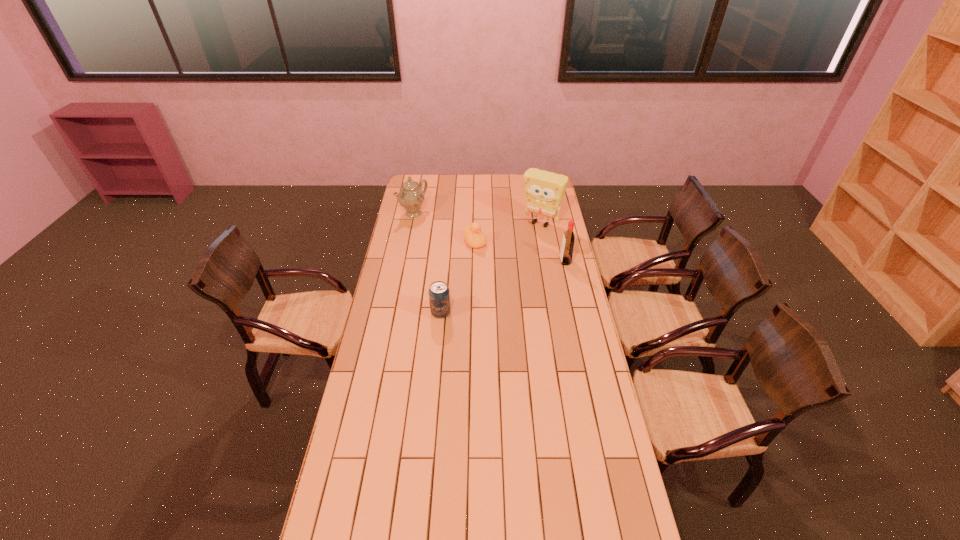
Where is `the second object from left to right`? This screenshot has width=960, height=540. the second object from left to right is located at coordinates (439, 294).

The height and width of the screenshot is (540, 960). I want to click on pop soda, so click(x=439, y=294).

Find the location of a particular element. The width and height of the screenshot is (960, 540). the second nearest object is located at coordinates (566, 253).

What are the coordinates of `the third farthest object` in the screenshot? It's located at (473, 237).

Where is `duck`? Image resolution: width=960 pixels, height=540 pixels. duck is located at coordinates (473, 237).

The width and height of the screenshot is (960, 540). What are the coordinates of `the tallest object` in the screenshot? It's located at (544, 191).

Where is `chinaware`? The width and height of the screenshot is (960, 540). chinaware is located at coordinates (411, 197).

At what (x,y) coordinates should I click in order to perform the action: click on free spot located 0.070m on the front of the pop soda. Please return your answer as a coordinate pair (x, y). Image resolution: width=960 pixels, height=540 pixels. Looking at the image, I should click on pyautogui.click(x=439, y=332).

Locate an element on the screen. The height and width of the screenshot is (540, 960). free region located on the front and back of the vodka is located at coordinates (500, 261).

Locate an element on the screen. free space located 0.350m on the front and back of the vodka is located at coordinates (491, 261).